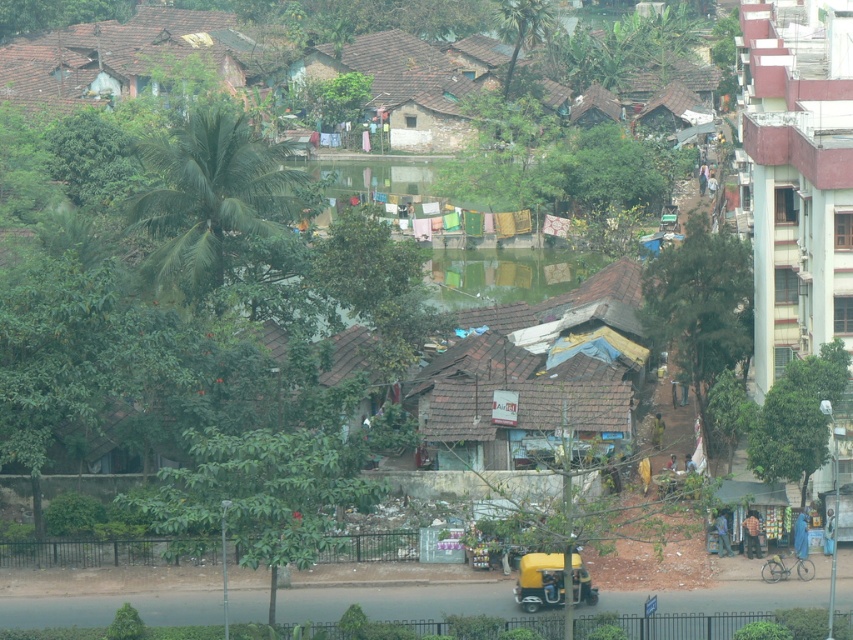
Locate an element on the screen. Image resolution: width=853 pixels, height=640 pixels. green leafy tree at center is located at coordinates (640, 524).

Can you confirm if green leafy tree at center is shorter than yellow matte auto-rickshaw at lower center?

Incorrect, green leafy tree at center's height does not fall short of yellow matte auto-rickshaw at lower center's.

Is point (624, 497) behind point (540, 600)?

Yes.

At what (x,y) coordinates should I click in order to perform the action: click on green leafy tree at center. Please return your answer as a coordinate pair (x, y). This screenshot has height=640, width=853. Looking at the image, I should click on (640, 524).

Which is behind, point (792, 202) or point (728, 300)?

The point (728, 300) is more distant.

Find the location of a particular element. This screenshot has height=640, width=853. light beige concrete building at upper right is located at coordinates (798, 173).

Which is below, green leafy tree at lower left or yellow matte auto-rickshaw at lower center?

yellow matte auto-rickshaw at lower center is below.

Who is more forward, (281,499) or (554,586)?

Point (281,499)

Locate an element on the screen. The height and width of the screenshot is (640, 853). green leafy tree at lower left is located at coordinates (257, 496).